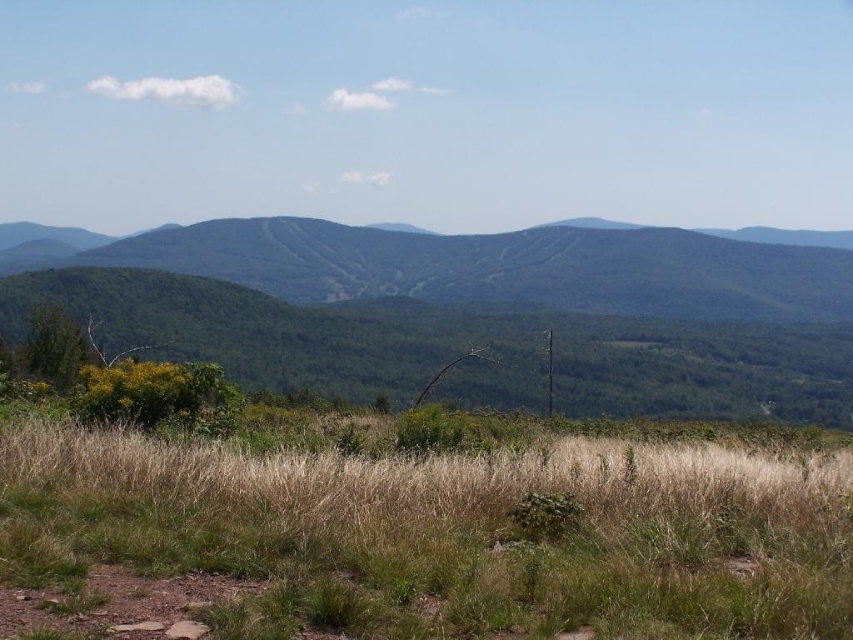
You are standing in the middle of the golden grass in the foreground of this landscape. You see two points marked in the image. Which point is closer to you, point (364, 520) or point (107, 253)?

Point (364, 520) is closer to you than point (107, 253).

You are standing at the edge of the green grassy field at center and looking towards the green forested mountain at center. Which object is taller?

The green forested mountain at center is taller than the green grassy field at center.

You are a hiker planning to cross the landscape shown in the image. You need to choose between walking through the green grassy field at center or the green forested mountain at center. Which path would be narrower?

The green grassy field at center is thinner than the green forested mountain at center, so the green grassy field at center would be the narrower path.